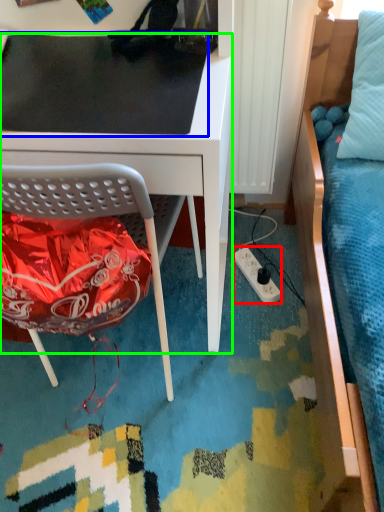
Question: Which object is positioned closest to power outlet (highlighted by a red box)? Select from table top (highlighted by a blue box) and desk (highlighted by a green box).

Choices:
 (A) table top
 (B) desk

Answer: (B)